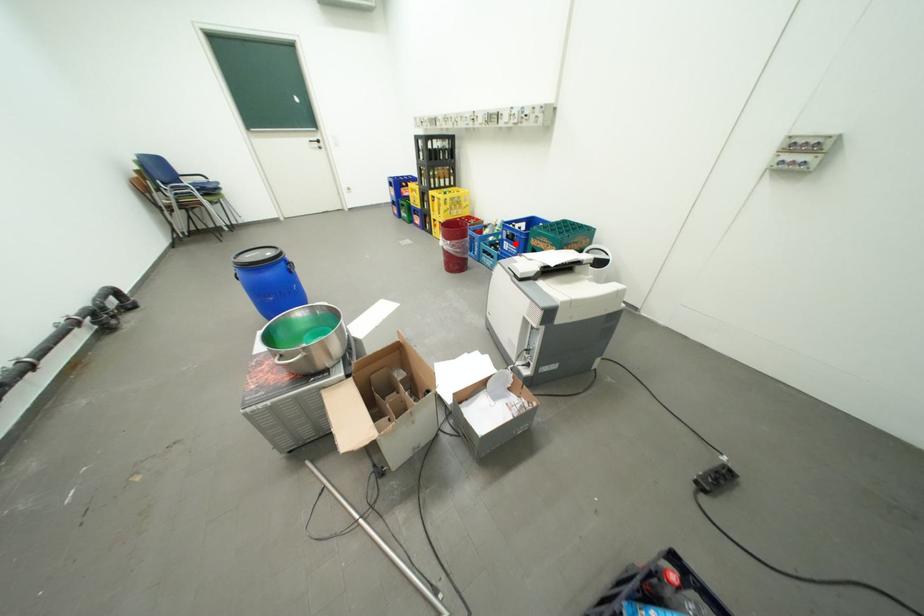
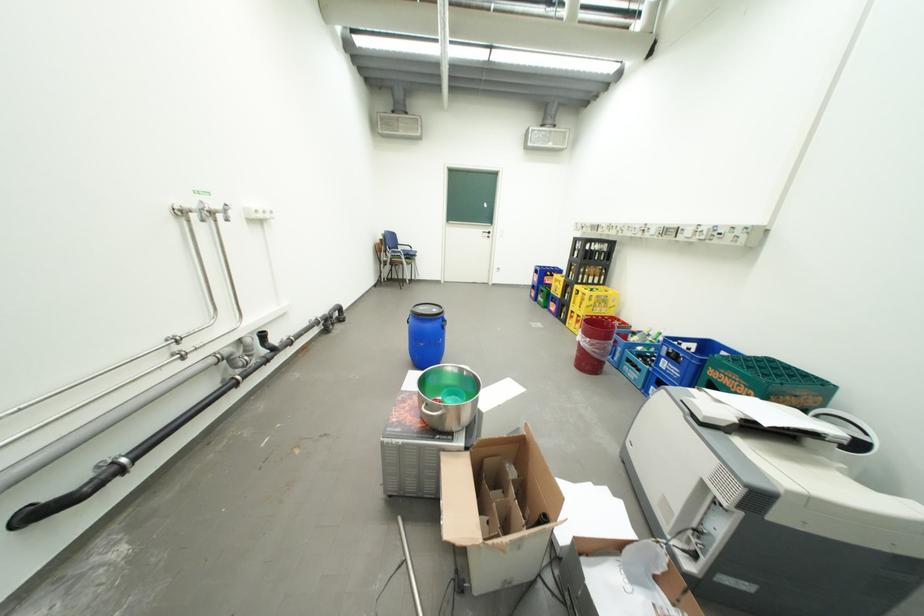
In the second image, find the point that corresponds to the highlighted location in the first image.

(674, 361)